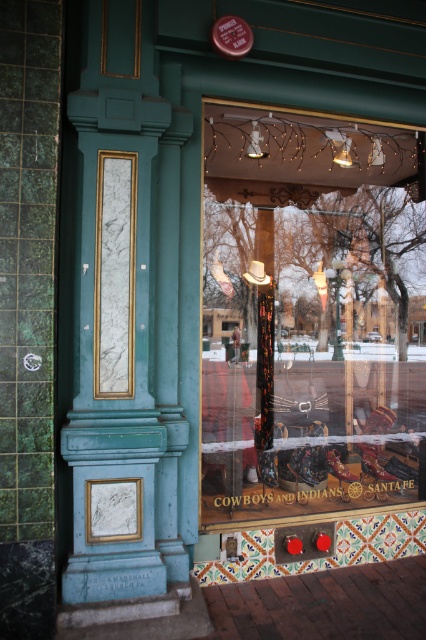
Does matte black cowboy boots at center have a lesser width compared to shiny brown leather shoe at center?

In fact, matte black cowboy boots at center might be wider than shiny brown leather shoe at center.

Which is behind, point (389, 145) or point (347, 474)?

Point (389, 145)

At what (x,y) coordinates should I click in order to perform the action: click on matte black cowboy boots at center. Please return your answer as a coordinate pair (x, y). Looking at the image, I should click on (308, 314).